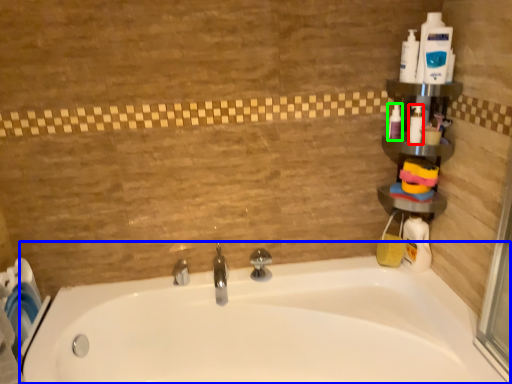
Question: Considering the real-world distances, which object is closest to cleaning product (highlighted by a red box)? bathtub (highlighted by a blue box) or cleaning product (highlighted by a green box).

Choices:
 (A) bathtub
 (B) cleaning product

Answer: (B)